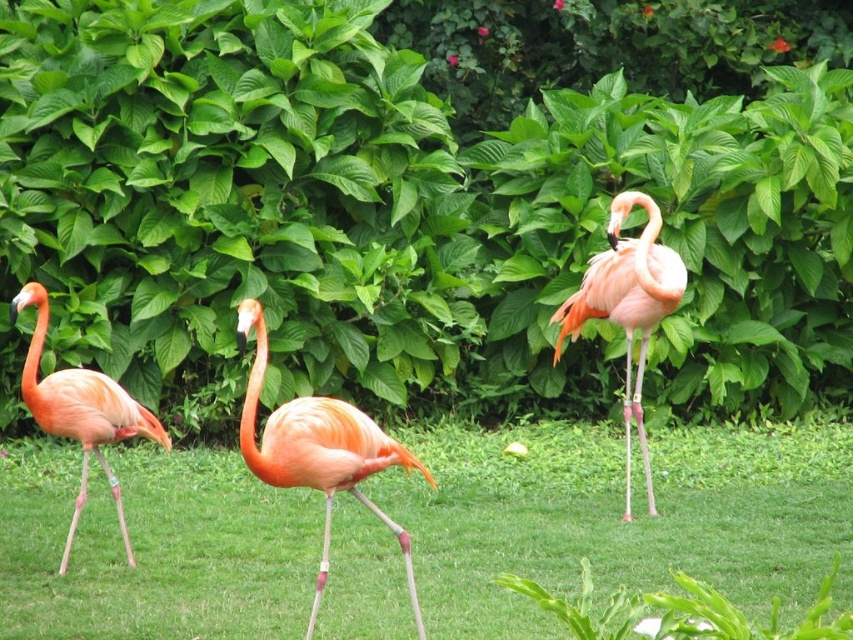
Question: Which point is closer to the camera?

Choices:
 (A) matte orange flamingo at center
 (B) green grass at center

Answer: (A)

Question: Which of the following is the closest to the observer?

Choices:
 (A) (94, 380)
 (B) (259, 627)
 (C) (630, 412)

Answer: (B)

Question: Can you confirm if green grass at center is positioned to the right of pink matte flamingo at center?

Choices:
 (A) yes
 (B) no

Answer: (B)

Question: Does green grass at center lie behind pink matte flamingo at left?

Choices:
 (A) no
 (B) yes

Answer: (B)

Question: Can you confirm if green grass at center is positioned to the left of pink matte flamingo at left?

Choices:
 (A) no
 (B) yes

Answer: (A)

Question: Which object appears farthest from the camera in this image?

Choices:
 (A) pink matte flamingo at center
 (B) matte orange flamingo at center
 (C) pink matte flamingo at left

Answer: (A)